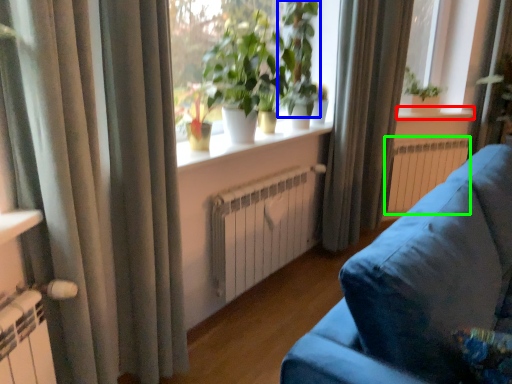
Question: Estimate the real-world distances between objects in this image. Which object is farther from window sill (highlighted by a red box), vegetation (highlighted by a blue box) or radiator (highlighted by a green box)?

Choices:
 (A) vegetation
 (B) radiator

Answer: (A)